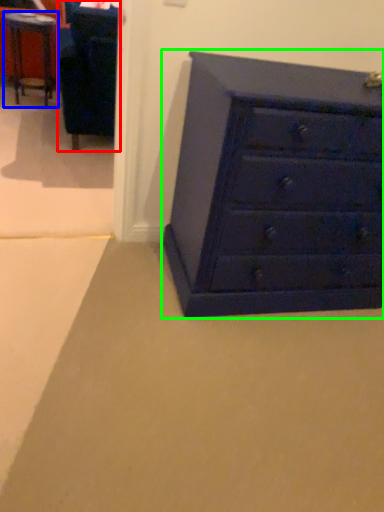
Question: Considering the real-world distances, which object is farthest from furniture (highlighted by a red box)? table (highlighted by a blue box) or chest of drawers (highlighted by a green box)?

Choices:
 (A) table
 (B) chest of drawers

Answer: (B)